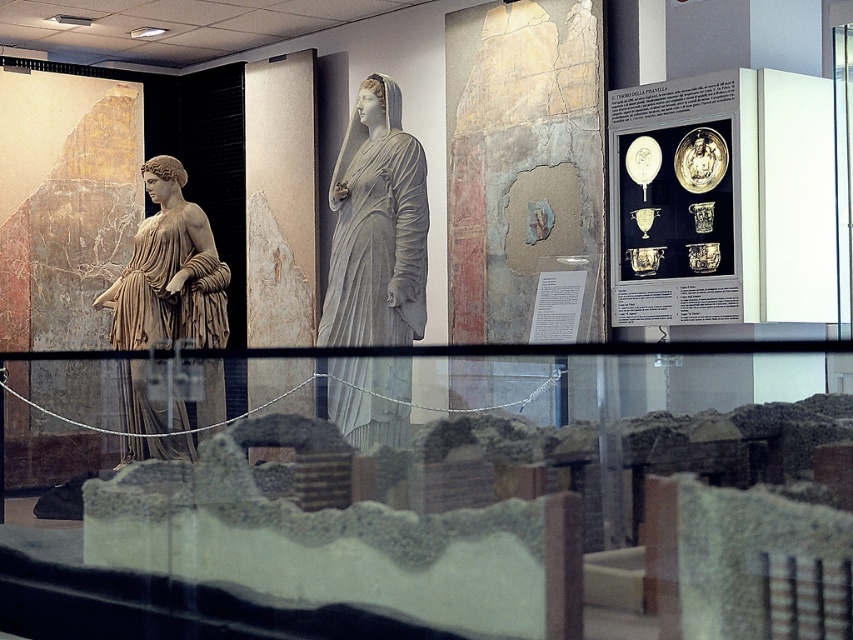
Question: Is gray stone statue at center wider than matte beige statue at left?

Choices:
 (A) no
 (B) yes

Answer: (A)

Question: Which of the following is the closest to the observer?

Choices:
 (A) matte beige statue at left
 (B) gray stone statue at center

Answer: (B)

Question: Which object is farther from the camera taking this photo?

Choices:
 (A) gray stone statue at center
 (B) matte beige statue at left

Answer: (B)

Question: Is gray stone statue at center smaller than matte beige statue at left?

Choices:
 (A) yes
 (B) no

Answer: (A)

Question: Can you confirm if gray stone statue at center is smaller than matte beige statue at left?

Choices:
 (A) yes
 (B) no

Answer: (A)